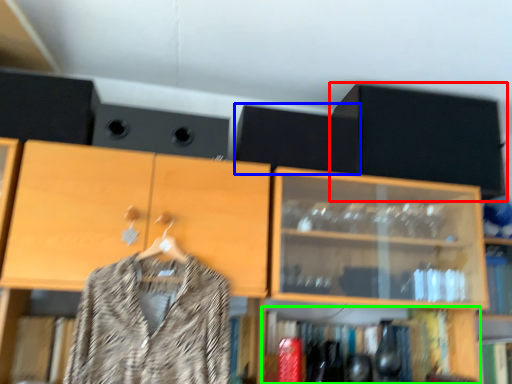
Question: Which is nearer to the cabinetry (highlighted by a red box)? speaker (highlighted by a blue box) or shelf (highlighted by a green box).

Choices:
 (A) speaker
 (B) shelf

Answer: (A)